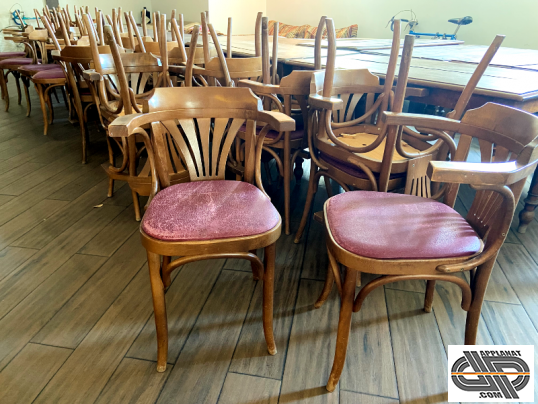
At what (x,y) coordinates should I click in order to perform the action: click on pink soft cushion. Please return your answer as a coordinate pair (x, y). This screenshot has height=404, width=538. Looking at the image, I should click on (424, 228), (352, 168), (228, 206), (295, 133), (47, 74), (32, 65), (20, 61), (5, 54).